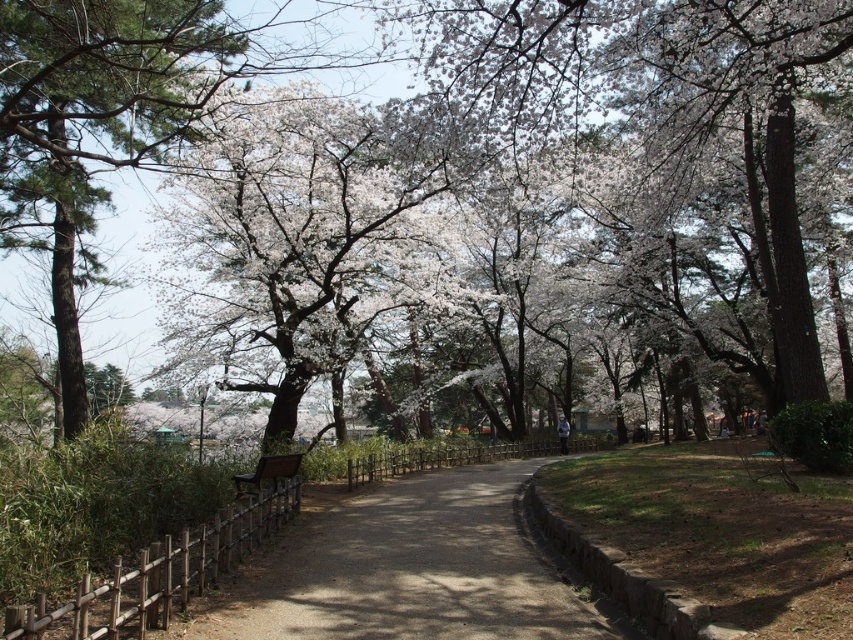
Question: Which object appears closest to the camera in this image?

Choices:
 (A) smooth bark tree at left
 (B) brown gravel path at center
 (C) white blossoming tree at center

Answer: (B)

Question: Is white blossoms at center behind smooth bark tree at left?

Choices:
 (A) no
 (B) yes

Answer: (B)

Question: Among these points, which one is nearest to the camera?

Choices:
 (A) (312, 344)
 (B) (9, 99)

Answer: (B)

Question: Where is white blossoms at center located in relation to brown gravel path at center in the image?

Choices:
 (A) left
 (B) right

Answer: (B)

Question: Which of the following is the farthest from the observer?

Choices:
 (A) brown gravel path at center
 (B) wooden bench at center
 (C) white blossoming tree at center
 (D) smooth bark tree at left

Answer: (C)

Question: Is white blossoms at center bigger than wooden bench at center?

Choices:
 (A) no
 (B) yes

Answer: (B)